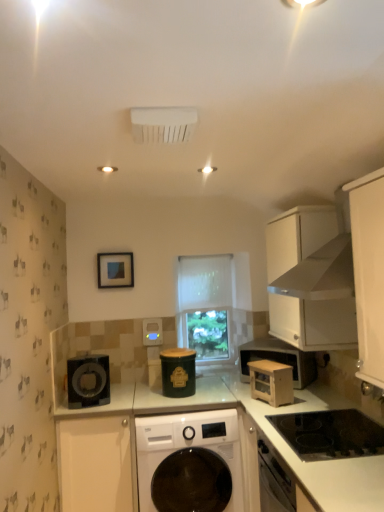
Question: Is white sheer curtain at center taller or shorter than white glossy washing machine at center?

Choices:
 (A) tall
 (B) short

Answer: (B)

Question: Based on their positions, is white sheer curtain at center located to the left or right of white glossy washing machine at center?

Choices:
 (A) left
 (B) right

Answer: (B)

Question: Which is farther from the white matte cabinet at upper right, which is the second cabinetry in left-to-right order?

Choices:
 (A) white sheer at center
 (B) white glossy countertop at lower right
 (C) white matte cabinet at lower left, which is counted as the 2th cabinetry, starting from the top
 (D) matte blue picture frame at upper center
 (E) white sheer curtain at center

Answer: (C)

Question: Which object is the closest to the white sheer curtain at center?

Choices:
 (A) white matte cabinet at lower left, which ranks as the 2th cabinetry in right-to-left order
 (B) wooden stool at lower right
 (C) wooden microwave at center-right
 (D) green matte canister at center, the 2th appliance when ordered from front to back
 (E) white matte cabinet at upper right, placed as the 2th cabinetry when sorted from bottom to top

Answer: (B)